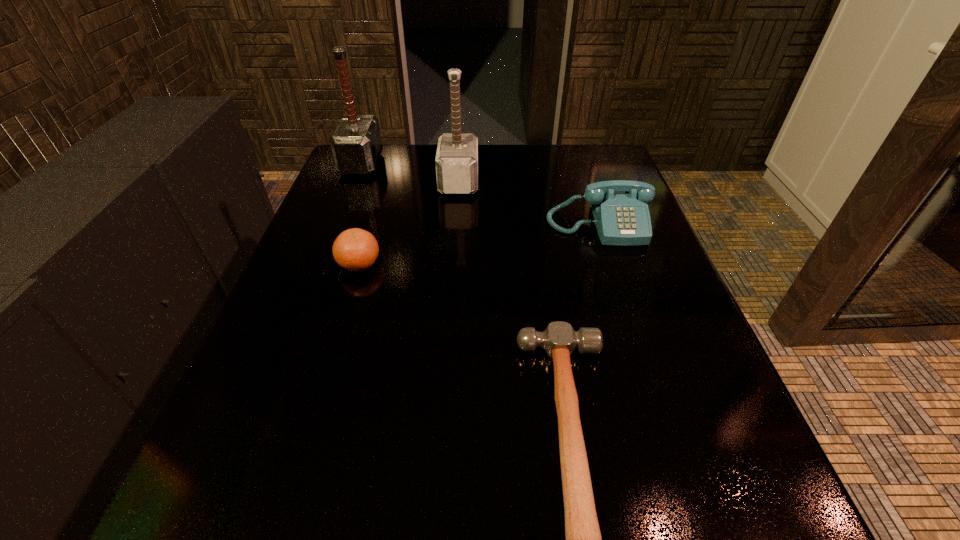
The width and height of the screenshot is (960, 540). I want to click on hammer present at the left edge, so click(356, 145).

Find the location of a particular element. The width and height of the screenshot is (960, 540). clementine located at the left edge is located at coordinates (355, 249).

Find the location of a particular element. This screenshot has height=540, width=960. object that is at the right edge is located at coordinates (620, 208).

This screenshot has height=540, width=960. In order to click on object positioned at the far left corner in this screenshot , I will do click(356, 145).

You are a GUI agent. You are given a task and a screenshot of the screen. Output one action in this format:
    pyautogui.click(x=<x>, y=<y>)
    Task: Click on the vacant area at the far edge of the desktop
    The image size is (960, 540).
    Given the screenshot: What is the action you would take?
    pyautogui.click(x=504, y=188)

Identify the location of vacant space at the left edge of the desktop. This screenshot has width=960, height=540. (275, 361).

At what (x,y) coordinates should I click in order to perform the action: click on vacant space at the right edge of the desktop. Please return your answer as a coordinate pair (x, y). The image size is (960, 540). Looking at the image, I should click on (597, 272).

In the image, there is a desktop. Identify the location of free space at the far right corner. This screenshot has width=960, height=540. (612, 150).

You are a GUI agent. You are given a task and a screenshot of the screen. Output one action in this format:
    pyautogui.click(x=<x>, y=<y>)
    Task: Click on the free space between the clementine and the leftmost hammer
    
    Given the screenshot: What is the action you would take?
    pyautogui.click(x=360, y=214)

You are a GUI agent. You are given a task and a screenshot of the screen. Output one action in this format:
    pyautogui.click(x=<x>, y=<y>)
    Task: Click on the free space between the leftmost hammer and the third nearest object
    
    Given the screenshot: What is the action you would take?
    pyautogui.click(x=480, y=194)